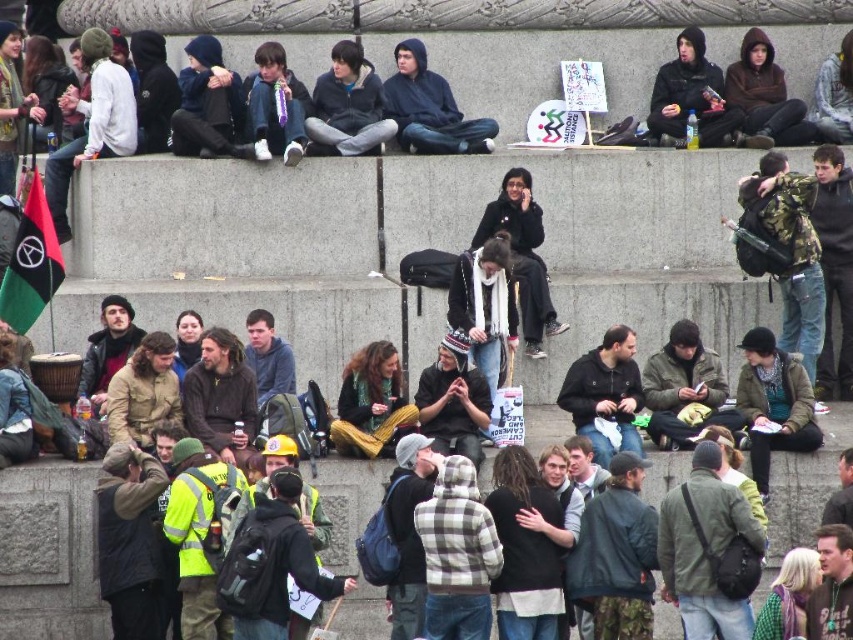
You are standing at the top of the tiered wall and want to move towards the nearest point between point (399, 93) and point (693, 97). Which point should you walk towards?

Point (399, 93) is closer to the viewer than point (693, 97), so you should walk towards point (399, 93).

You are standing at the origin point of the coordinate system in the image. Where is the dark blue hoodie at center located?

The dark blue hoodie at center is located at point (430, 108).

You are a photographer positioned at the bottom of the tiered wall. You want to capture both the dark blue hoodie at center and the dark gray hoodie at upper right in a single shot. Which direction should you pan your camera to include both subjects?

To include both the dark blue hoodie at center and the dark gray hoodie at upper right in the shot, you should pan your camera to the right since the dark blue hoodie at center is to the left of the dark gray hoodie at upper right.